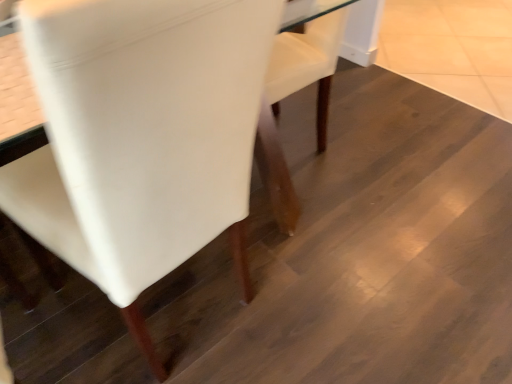
This screenshot has height=384, width=512. What do you see at coordinates (146, 131) in the screenshot? I see `white leather chair at center` at bounding box center [146, 131].

Image resolution: width=512 pixels, height=384 pixels. I want to click on white leather chair at center, so click(146, 131).

Find the location of `white leather chair at center`. white leather chair at center is located at coordinates (146, 131).